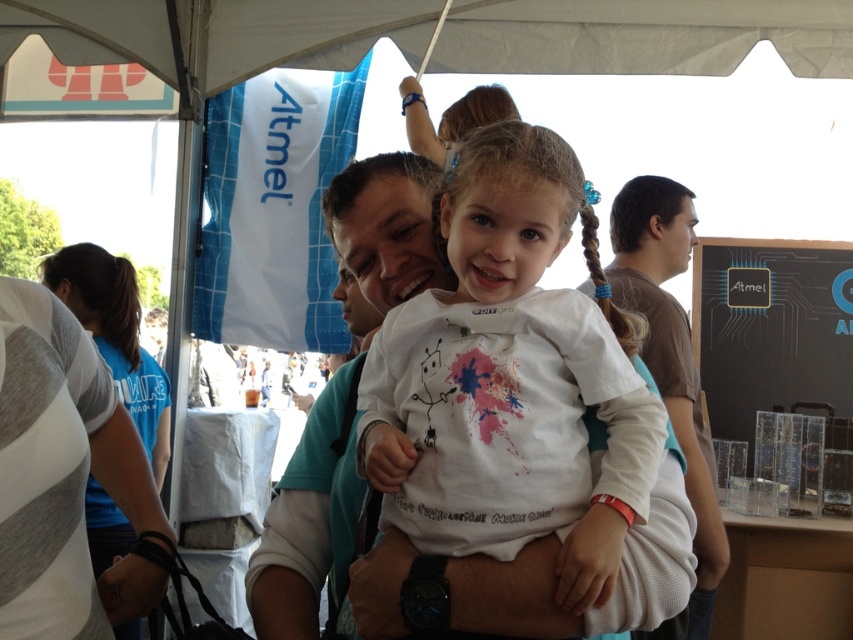
You are organizing a photo shoot and need to place a prop at a specific coordinate. The prop must be placed exactly where the white cotton shirt at center is located. What are the coordinates where you should place the prop?

The coordinates for the white cotton shirt at center are at point [511,378], so you should place the prop there.